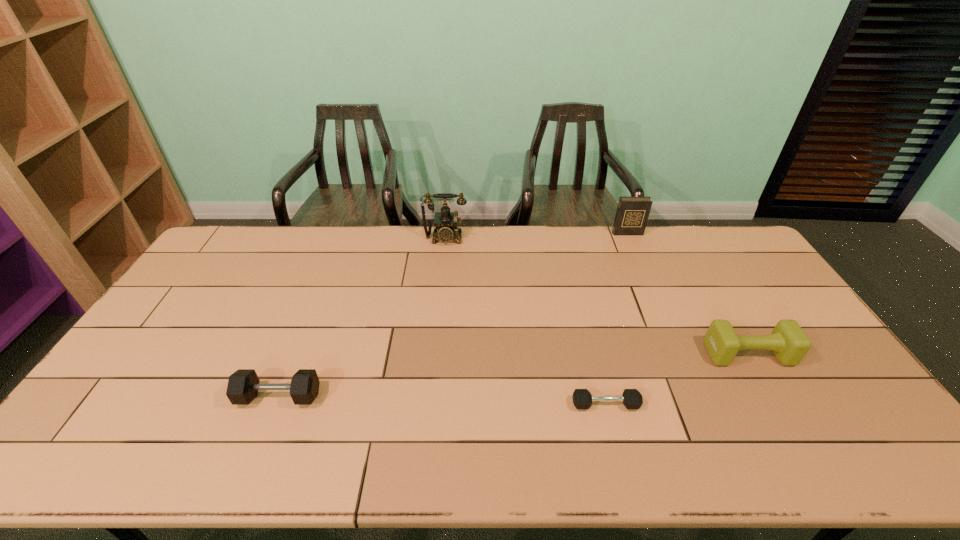
At what (x,y) coordinates should I click in order to perform the action: click on the tallest object. Please return your answer as a coordinate pair (x, y). Looking at the image, I should click on (445, 221).

At what (x,y) coordinates should I click in order to perform the action: click on telephone. Please return your answer as a coordinate pair (x, y). The image size is (960, 540). Looking at the image, I should click on (445, 221).

Locate an element on the screen. The image size is (960, 540). the fourth shortest object is located at coordinates (632, 213).

The width and height of the screenshot is (960, 540). Find the location of `the second object from right to left`. the second object from right to left is located at coordinates (632, 213).

This screenshot has width=960, height=540. In order to click on the rightmost object in this screenshot , I will do `click(789, 343)`.

You are a GUI agent. You are given a task and a screenshot of the screen. Output one action in this format:
    pyautogui.click(x=<x>, y=<y>)
    Task: Click on the rightmost dumbbell
    
    Given the screenshot: What is the action you would take?
    pyautogui.click(x=789, y=343)

The width and height of the screenshot is (960, 540). Find the location of `the leftmost dumbbell`. the leftmost dumbbell is located at coordinates (243, 385).

Image resolution: width=960 pixels, height=540 pixels. I want to click on the second dumbbell from left to right, so click(x=631, y=398).

Locate an element on the screen. the shortest object is located at coordinates (631, 398).

What are the coordinates of `free space located on the rotary dial of the tallest object` in the screenshot? It's located at (x=437, y=329).